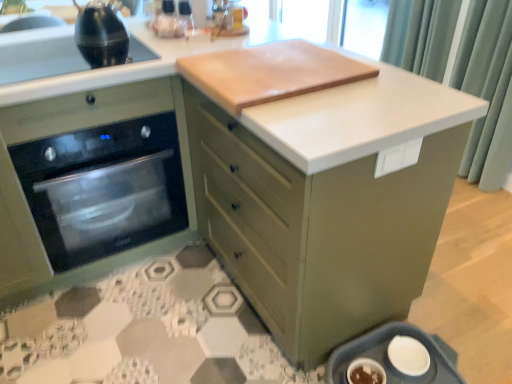
In the scene shown: What is the approximate height of shiny black kettle at upper left?

7.39 inches.

What do you see at coordinates (101, 34) in the screenshot? The height and width of the screenshot is (384, 512). I see `shiny black kettle at upper left` at bounding box center [101, 34].

Describe the element at coordinates (389, 359) in the screenshot. This screenshot has height=384, width=512. I see `matte green trash can at lower right` at that location.

Measure the distance between matte green trash can at lower right and camera.

matte green trash can at lower right is 1.47 meters away from camera.

At what (x,y) coordinates should I click in order to perform the action: click on green fabric curtain at upper right. Please return your answer as a coordinate pair (x, y). Image resolution: width=512 pixels, height=384 pixels. Looking at the image, I should click on (485, 79).

From the image's perspective, is green fabric curtain at upper right located beneath light brown wood cutting board at upper center?

No, from the image's perspective, green fabric curtain at upper right is not beneath light brown wood cutting board at upper center.

Considering the sizes of objects green fabric curtain at upper right and light brown wood cutting board at upper center in the image provided, who is wider, green fabric curtain at upper right or light brown wood cutting board at upper center?

light brown wood cutting board at upper center is wider.

From a real-world perspective, is green fabric curtain at upper right positioned under light brown wood cutting board at upper center based on gravity?

Yes, from a real-world perspective, green fabric curtain at upper right is beneath light brown wood cutting board at upper center.

Is green fabric curtain at upper right next to light brown wood cutting board at upper center and touching it?

green fabric curtain at upper right and light brown wood cutting board at upper center are not in contact.

Is matte green cabinet at center bigger than black glass sink at upper left?

Yes.

Which is nearer, (426, 171) or (37, 62)?

The point (426, 171) is closer.

Is matte green cabinet at center with black glass sink at upper left?

matte green cabinet at center is not next to black glass sink at upper left, and they're not touching.

The width and height of the screenshot is (512, 384). Identify the location of sink behind the matte green cabinet at center. 39,54.

Does shiny black kettle at upper left contain matte green trash can at lower right?

Definitely not — matte green trash can at lower right is not inside shiny black kettle at upper left.

Is shiny black kettle at upper left closer to camera compared to matte green trash can at lower right?

No, shiny black kettle at upper left is behind matte green trash can at lower right.

Considering the positions of objects shiny black kettle at upper left and matte green trash can at lower right in the image provided, who is more to the right, shiny black kettle at upper left or matte green trash can at lower right?

Positioned to the right is matte green trash can at lower right.

Locate an element on the screen. This screenshot has height=384, width=512. kitchen appliance above the matte green trash can at lower right (from the image's perspective) is located at coordinates (101, 34).

Who is taller, matte green cabinet at center or black glass oven at left?

Standing taller between the two is matte green cabinet at center.

Is matte green cabinet at center with black glass oven at left?

No, matte green cabinet at center is not touching black glass oven at left.

Who is more distant, matte green cabinet at center or black glass oven at left?

black glass oven at left is more distant.

Considering their positions, is black glass oven at left located in front of or behind shiny black kettle at upper left?

Clearly, black glass oven at left is in front of shiny black kettle at upper left.

From the image's perspective, which is above, black glass oven at left or shiny black kettle at upper left?

shiny black kettle at upper left is shown above in the image.

From a real-world perspective, which object stands above the other?

shiny black kettle at upper left is physically above.

Considering the positions of objects black glass oven at left and shiny black kettle at upper left in the image provided, who is more to the right, black glass oven at left or shiny black kettle at upper left?

shiny black kettle at upper left.

Is green fabric curtain at upper right looking in the opposite direction of shiny black kettle at upper left?

No, green fabric curtain at upper right is not facing the opposite direction of shiny black kettle at upper left.

Does point (472, 87) come in front of point (97, 1)?

Yes, it is in front of point (97, 1).

Choose the correct answer: Is green fabric curtain at upper right inside shiny black kettle at upper left or outside it?

The correct answer is: outside.

Between green fabric curtain at upper right and shiny black kettle at upper left, which one is positioned behind?

green fabric curtain at upper right is more distant.

Does black glass oven at left have a larger size compared to green fabric curtain at upper right?

Yes.

What's the angular difference between black glass oven at left and green fabric curtain at upper right's facing directions?

91.5 degrees separate the facing orientations of black glass oven at left and green fabric curtain at upper right.

From a real-world perspective, is black glass oven at left on top of green fabric curtain at upper right?

Incorrect, from a real-world perspective, black glass oven at left is lower than green fabric curtain at upper right.

From the image's perspective, is black glass oven at left located beneath green fabric curtain at upper right?

Yes.

The height and width of the screenshot is (384, 512). I want to click on wide below the green fabric curtain at upper right (from the image's perspective), so click(x=269, y=73).

Where is `sink that is above the matte green cabinet at center (from the image's perspective)`? sink that is above the matte green cabinet at center (from the image's perspective) is located at coordinates (39, 54).

Considering their positions, is light brown wood cutting board at upper center positioned closer to green fabric curtain at upper right than matte green trash can at lower right?

Based on the image, light brown wood cutting board at upper center appears to be nearer to green fabric curtain at upper right.

In the scene shown: When comparing their distances from black glass sink at upper left, does matte green cabinet at center or shiny black kettle at upper left seem further?

matte green cabinet at center lies further to black glass sink at upper left than the other object.

Looking at the image, which one is located further to light brown wood cutting board at upper center, shiny black kettle at upper left or matte green trash can at lower right?

The object further to light brown wood cutting board at upper center is matte green trash can at lower right.

Looking at the image, which one is located further to light brown wood cutting board at upper center, matte green cabinet at center or green fabric curtain at upper right?

Based on the image, green fabric curtain at upper right appears to be further to light brown wood cutting board at upper center.

From the image, which object appears to be farther from green fabric curtain at upper right, matte green cabinet at center or light brown wood cutting board at upper center?

matte green cabinet at center is further to green fabric curtain at upper right.

Looking at the image, which one is located further to green fabric curtain at upper right, black glass sink at upper left or matte green cabinet at center?

black glass sink at upper left.

Based on their spatial positions, is black glass oven at left or green fabric curtain at upper right closer to matte green trash can at lower right?

black glass oven at left is closer to matte green trash can at lower right.

Based on their spatial positions, is shiny black kettle at upper left or matte green trash can at lower right further from green fabric curtain at upper right?

shiny black kettle at upper left is positioned further to the anchor green fabric curtain at upper right.

The width and height of the screenshot is (512, 384). What are the coordinates of `sink between black glass oven at left and light brown wood cutting board at upper center in the horizontal direction` in the screenshot? It's located at (39, 54).

This screenshot has height=384, width=512. I want to click on appliance situated between shiny black kettle at upper left and green fabric curtain at upper right from left to right, so click(389, 359).

You are a GUI agent. You are given a task and a screenshot of the screen. Output one action in this format:
    pyautogui.click(x=<x>, y=<y>)
    Task: Click on the cabinetry located between black glass sink at upper left and light brown wood cutting board at upper center in the left-right direction
    The image size is (512, 384).
    Given the screenshot: What is the action you would take?
    pyautogui.click(x=318, y=229)

Locate an element on the screen. This screenshot has width=512, height=384. wide between green fabric curtain at upper right and matte green trash can at lower right in the vertical direction is located at coordinates (269, 73).